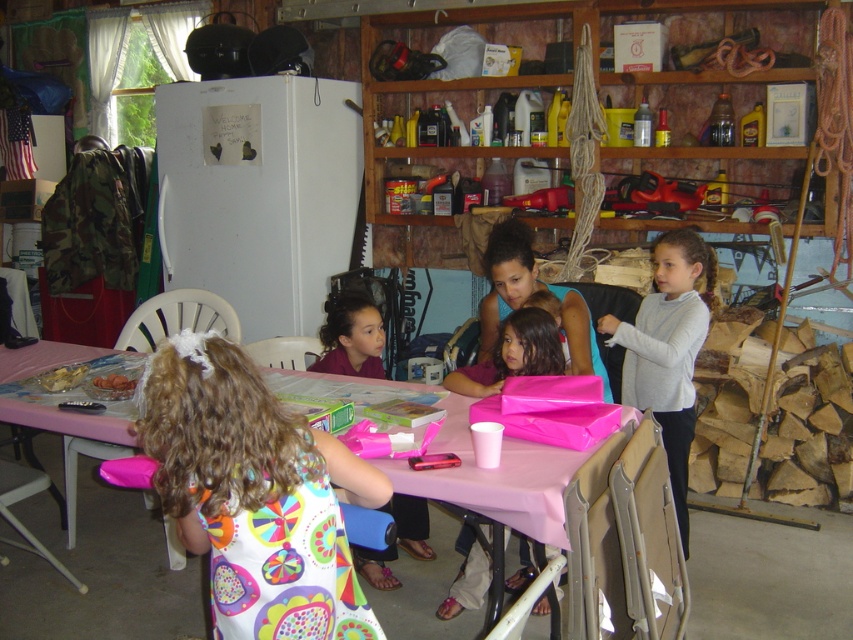
Question: Observing the image, what is the correct spatial positioning of multicolored fabric dress at lower left in reference to pink matte gift bag at center?

Choices:
 (A) left
 (B) right

Answer: (A)

Question: Which of the following is the closest to the observer?

Choices:
 (A) coord(498,333)
 (B) coord(144,380)
 (C) coord(705,307)
 (D) coord(53,525)

Answer: (B)

Question: Is multicolored fabric dress at lower left thinner than pink matte gift bag at center?

Choices:
 (A) no
 (B) yes

Answer: (A)

Question: Which object is positioned farthest from the pink paper table at center?

Choices:
 (A) white sweater at upper right
 (B) multicolored fabric dress at lower left

Answer: (A)

Question: Based on their relative distances, which object is farther from the multicolored fabric dress at lower left?

Choices:
 (A) pink paper table at center
 (B) white sweater at upper right
 (C) pink matte gift bag at center

Answer: (B)

Question: Does multicolored fabric dress at lower left appear on the left side of pink matte gift bag at center?

Choices:
 (A) yes
 (B) no

Answer: (A)